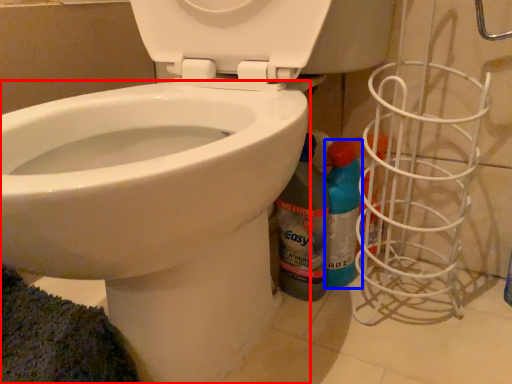
Question: Among these objects, which one is nearest to the camera, bidet (highlighted by a red box) or cleaning product (highlighted by a blue box)?

Choices:
 (A) bidet
 (B) cleaning product

Answer: (A)